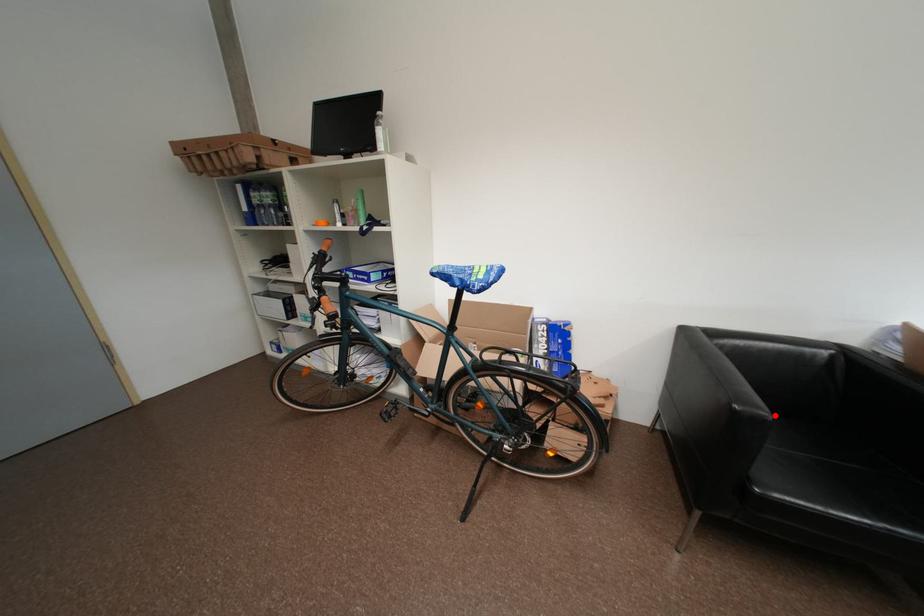
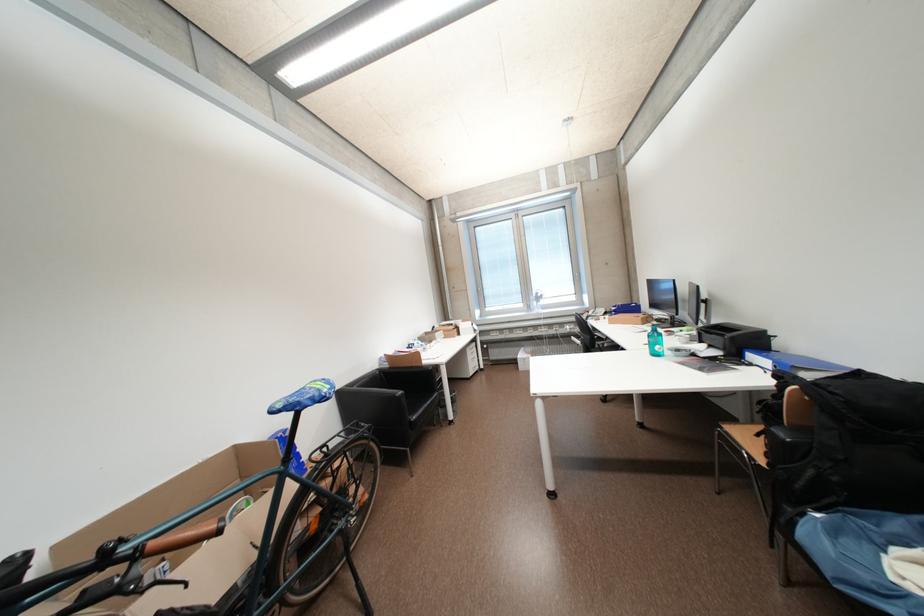
The point at the highlighted location is marked in the first image. Where is the corresponding point in the second image?

(408, 394)